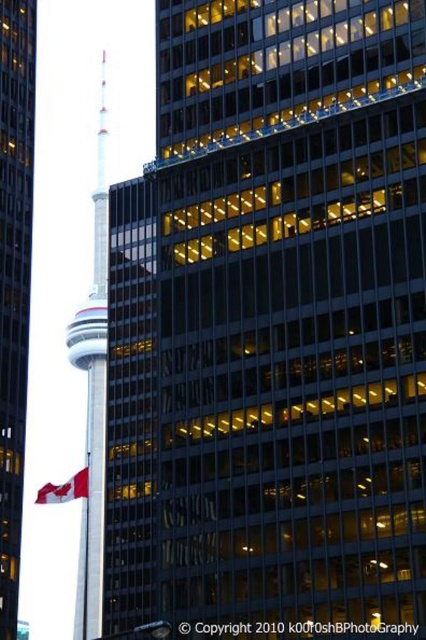
Which of these two, glassy steel tower at center or red fabric flag at left, stands shorter?

red fabric flag at left

Between point (3, 353) and point (54, 496), which one is positioned behind?

The point (54, 496) is more distant.

Describe the element at coordinates (14, 280) in the screenshot. The height and width of the screenshot is (640, 426). I see `glassy steel tower at center` at that location.

The image size is (426, 640). I want to click on glassy steel tower at center, so click(14, 280).

Does glassy steel tower at center have a lesser height compared to smooth glass tower at center?

Correct, glassy steel tower at center is not as tall as smooth glass tower at center.

Which is above, glassy steel tower at center or smooth glass tower at center?

glassy steel tower at center

Is point (14, 282) positioned in front of point (89, 477)?

Yes.

What are the coordinates of `glassy steel tower at center` in the screenshot? It's located at (14, 280).

Between smooth glass tower at center and red fabric flag at left, which one appears on the left side from the viewer's perspective?

From the viewer's perspective, red fabric flag at left appears more on the left side.

Does smooth glass tower at center appear on the right side of red fabric flag at left?

Correct, you'll find smooth glass tower at center to the right of red fabric flag at left.

This screenshot has width=426, height=640. Identify the location of smooth glass tower at center. (94, 394).